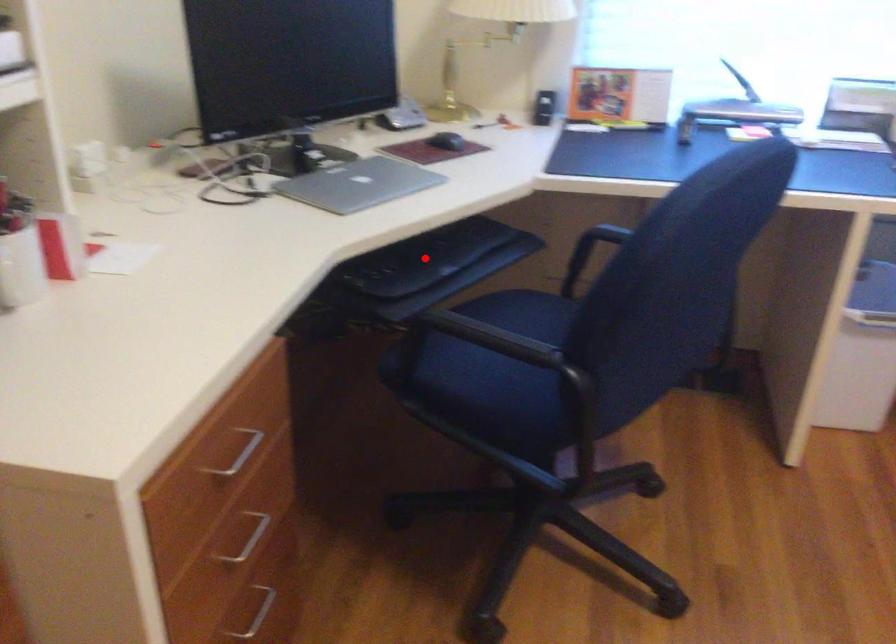
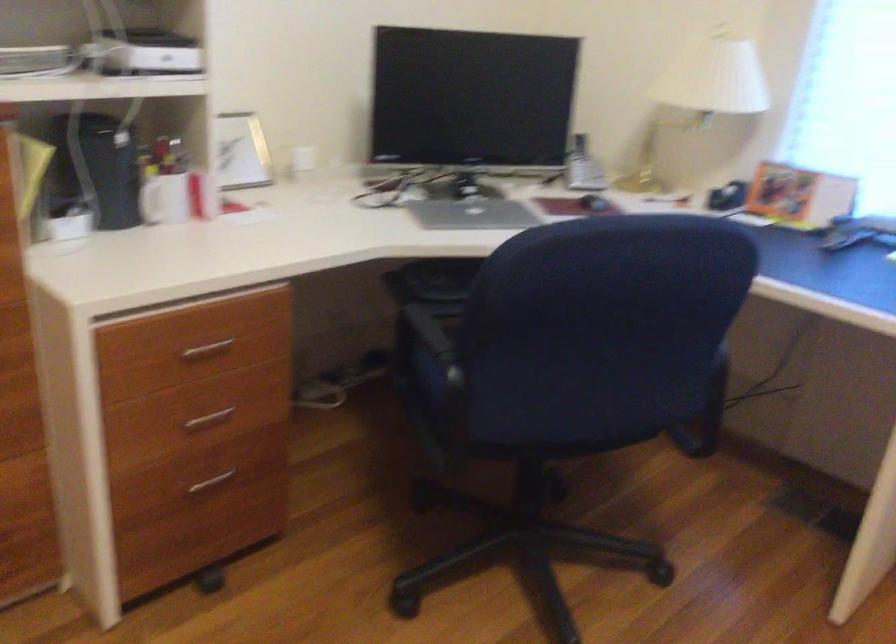
Question: I am providing you with two images of the same scene from different viewpoints. A red point is marked on the first image. Is the red point's position out of view in image 2?

Choices:
 (A) Yes
 (B) No

Answer: (A)